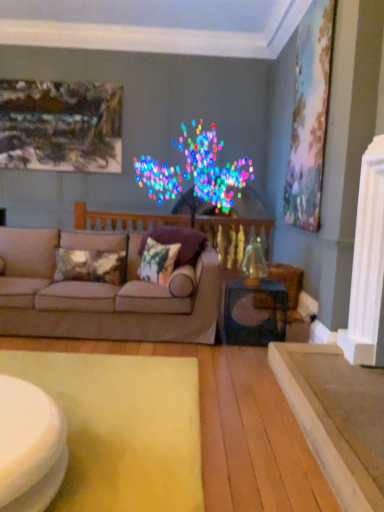
Locate an element on the screen. free location in front of matte black side table at lower right is located at coordinates (235, 356).